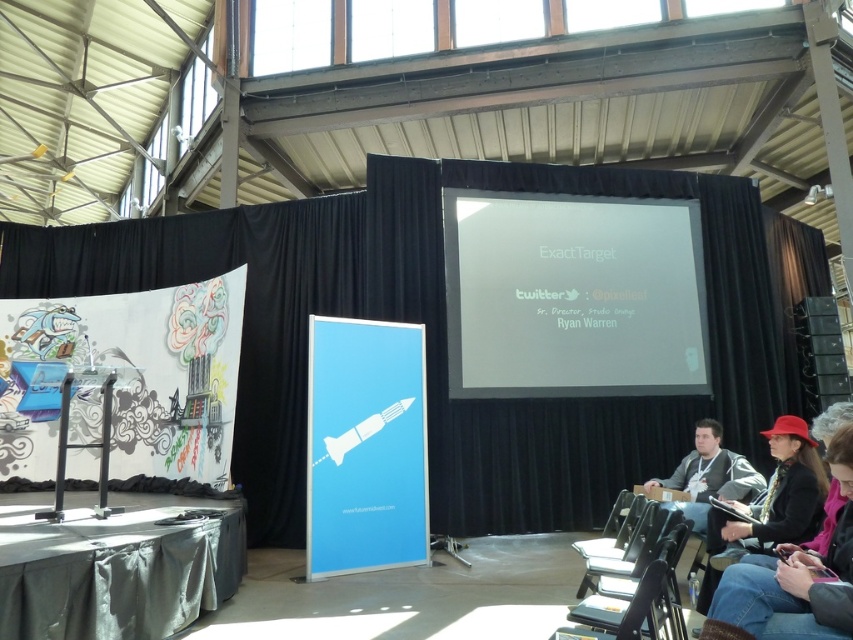
You are setting up for a presentation in the event space and need to decide whether to use the black matte curtain at center or the white matte projector screen at center. Based on their sizes, which one would be more suitable for projecting a presentation slide?

The white matte projector screen at center is more suitable for projecting presentation slides because it is larger than the black matte curtain at center, providing a better surface for clear visibility.

You are organizing a small presentation in the event space and need to move the matte black jacket at lower right to make space. However, you want to ensure that moving it won not obstruct the black matte curtain at center. Can you move it forward or backward?

The matte black jacket at lower right is behind the black matte curtain at center. Since it is behind, you can move it forward towards the front of the curtain without obstructing it. Moving it backward might not be possible if there is no space behind the curtain.